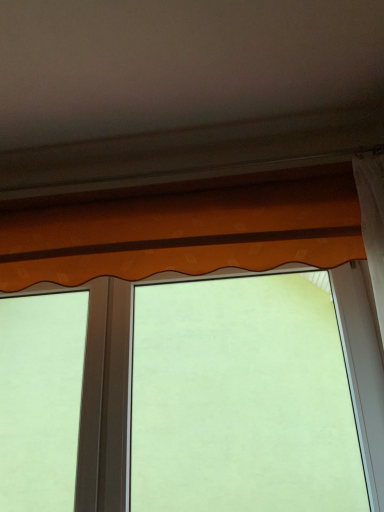
Question: Considering the positions of orange fabric valance at center and orange fabric curtain at upper center in the image, is orange fabric valance at center wider or thinner than orange fabric curtain at upper center?

Choices:
 (A) wide
 (B) thin

Answer: (B)

Question: From the image's perspective, is orange fabric valance at center above or below orange fabric curtain at upper center?

Choices:
 (A) above
 (B) below

Answer: (B)

Question: Is orange fabric valance at center bigger or smaller than orange fabric curtain at upper center?

Choices:
 (A) big
 (B) small

Answer: (A)

Question: Does point (109, 208) appear closer or farther from the camera than point (96, 481)?

Choices:
 (A) closer
 (B) farther

Answer: (B)

Question: Looking at their shapes, would you say orange fabric curtain at upper center is wider or thinner than orange fabric valance at center?

Choices:
 (A) thin
 (B) wide

Answer: (B)

Question: Would you say orange fabric curtain at upper center is inside or outside orange fabric valance at center?

Choices:
 (A) inside
 (B) outside

Answer: (B)

Question: In the image, is orange fabric curtain at upper center positioned in front of or behind orange fabric valance at center?

Choices:
 (A) front
 (B) behind

Answer: (A)